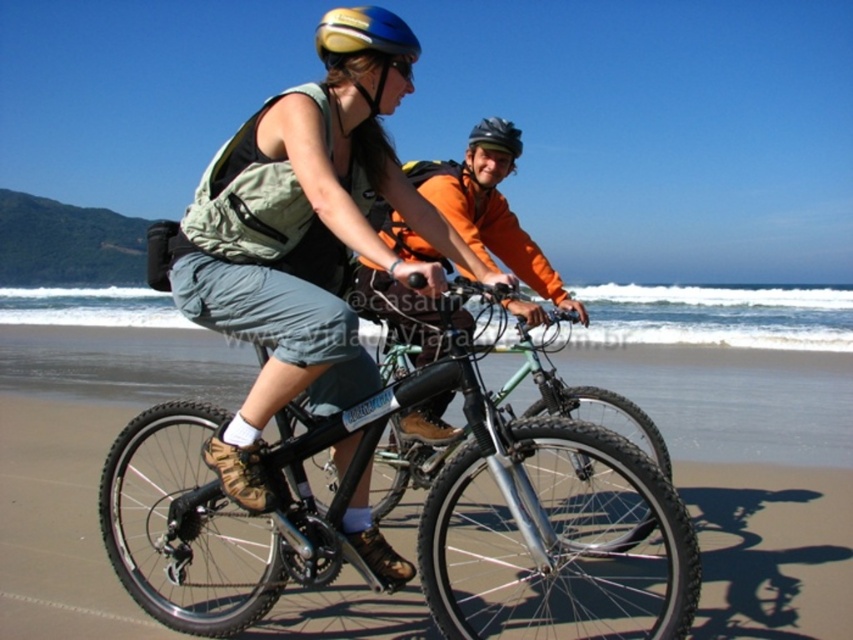
Question: Which object is positioned closest to the yellow matte bicycle helmet at upper center?

Choices:
 (A) black matte bicycle at center
 (B) orange fleece jacket at center

Answer: (B)

Question: Which point is closer to the camera taking this photo?

Choices:
 (A) (680, 627)
 (B) (387, 10)
 (C) (505, 225)

Answer: (A)

Question: Can you confirm if orange fleece jacket at center is positioned to the right of yellow matte bicycle helmet at upper center?

Choices:
 (A) yes
 (B) no

Answer: (A)

Question: Which point appears farthest from the camera in this image?

Choices:
 (A) (401, 45)
 (B) (396, 241)
 (C) (625, 470)

Answer: (B)

Question: Is black matte bicycle at center further to the viewer compared to orange fleece jacket at center?

Choices:
 (A) yes
 (B) no

Answer: (B)

Question: Is black matte bicycle at center to the right of yellow matte bicycle helmet at upper center from the viewer's perspective?

Choices:
 (A) yes
 (B) no

Answer: (B)